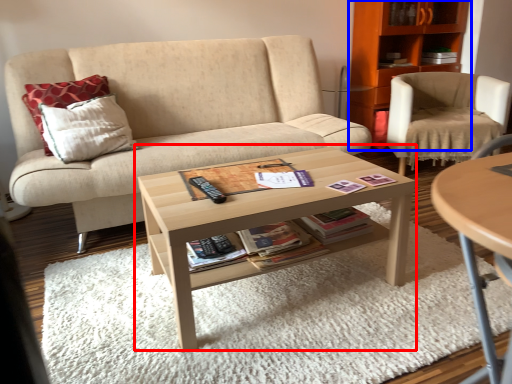
Question: Among these objects, which one is nearest to the camera, coffee table (highlighted by a red box) or cabinetry (highlighted by a blue box)?

Choices:
 (A) coffee table
 (B) cabinetry

Answer: (A)